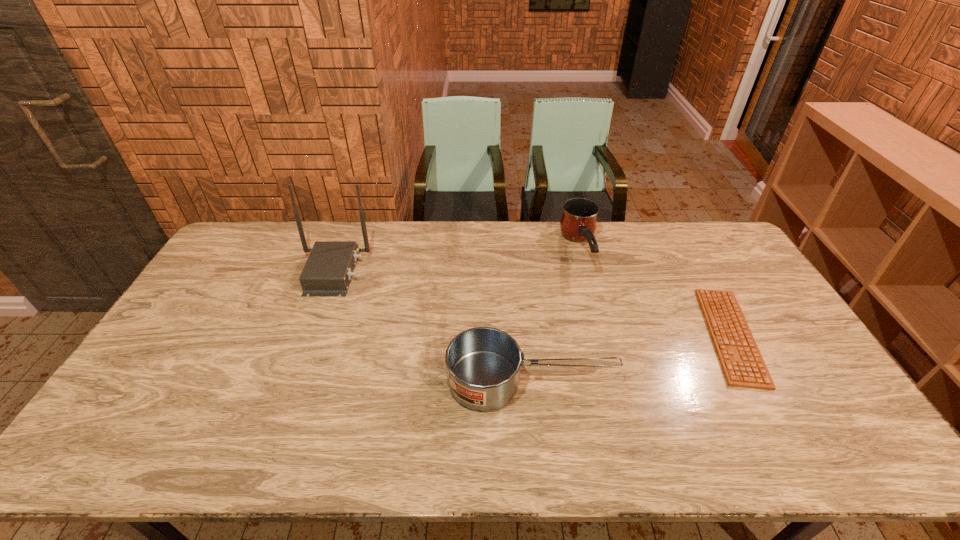
Locate an element on the screen. The height and width of the screenshot is (540, 960). empty space between the shorter saucepan and the leftmost object is located at coordinates (432, 327).

This screenshot has width=960, height=540. Identify the location of vacant space that's between the leftmost object and the farther saucepan. (457, 261).

Identify the location of free space between the tallest object and the shorter saucepan. 432,327.

Locate an element on the screen. This screenshot has width=960, height=540. free space between the leftmost object and the farther saucepan is located at coordinates (457, 261).

In order to click on blank region between the tallest object and the computer keyboard in this screenshot , I will do `click(532, 303)`.

At what (x,y) coordinates should I click in order to perform the action: click on unoccupied position between the tallest object and the shortest object. Please return your answer as a coordinate pair (x, y). Image resolution: width=960 pixels, height=540 pixels. Looking at the image, I should click on (532, 303).

Locate an element on the screen. vacant space that's between the nearer saucepan and the computer keyboard is located at coordinates (631, 359).

At what (x,y) coordinates should I click in order to perform the action: click on blank region between the second tallest object and the leftmost object. Please return your answer as a coordinate pair (x, y). The height and width of the screenshot is (540, 960). Looking at the image, I should click on (457, 261).

Where is `empty location between the third tallest object and the shortest object`? The width and height of the screenshot is (960, 540). empty location between the third tallest object and the shortest object is located at coordinates (631, 359).

Find the location of a particular element. empty space that is in between the shortest object and the router is located at coordinates (532, 303).